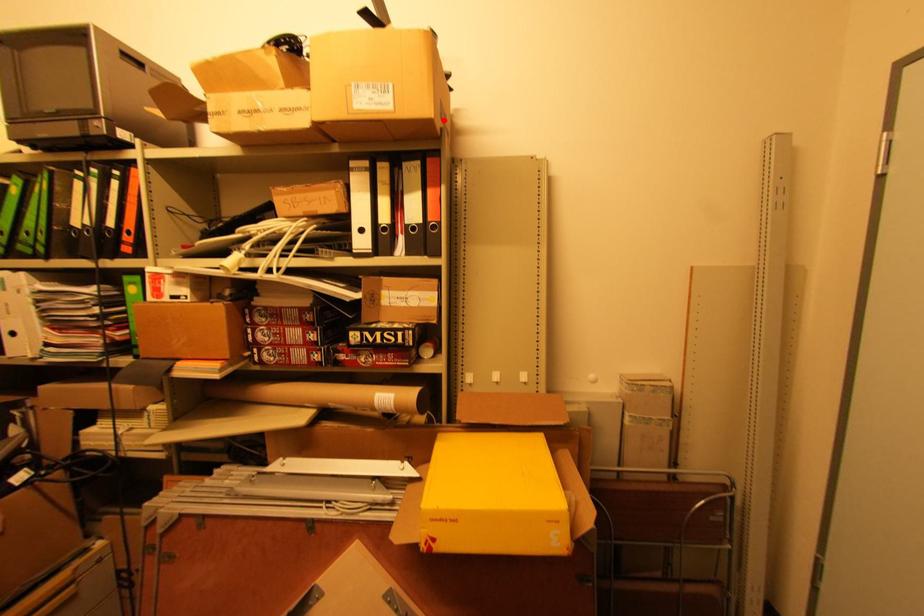
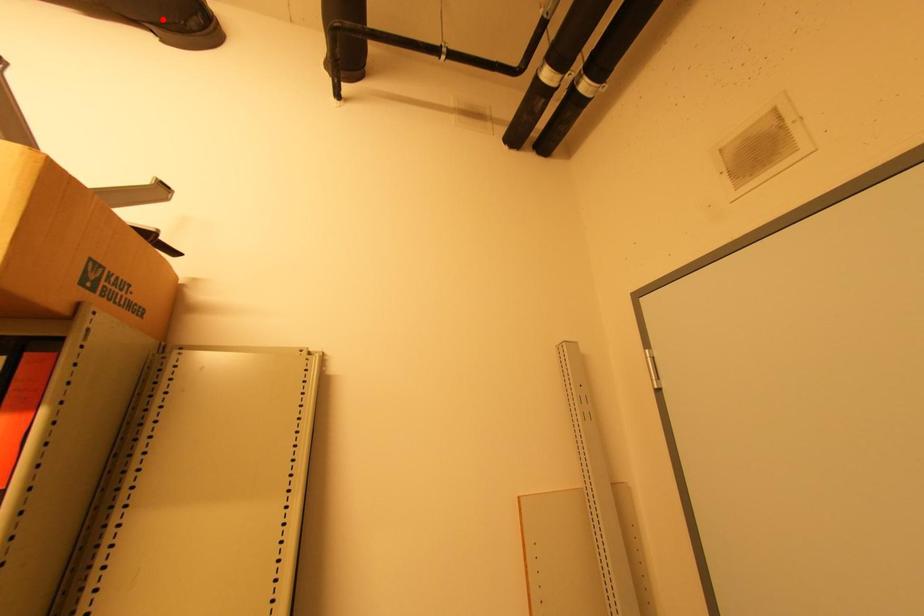
I am providing you with two images of the same scene from different viewpoints. A red point is marked on the first image and another point is marked on the second image. Does the point marked in image1 correspond to the same location as the one in image2?

No